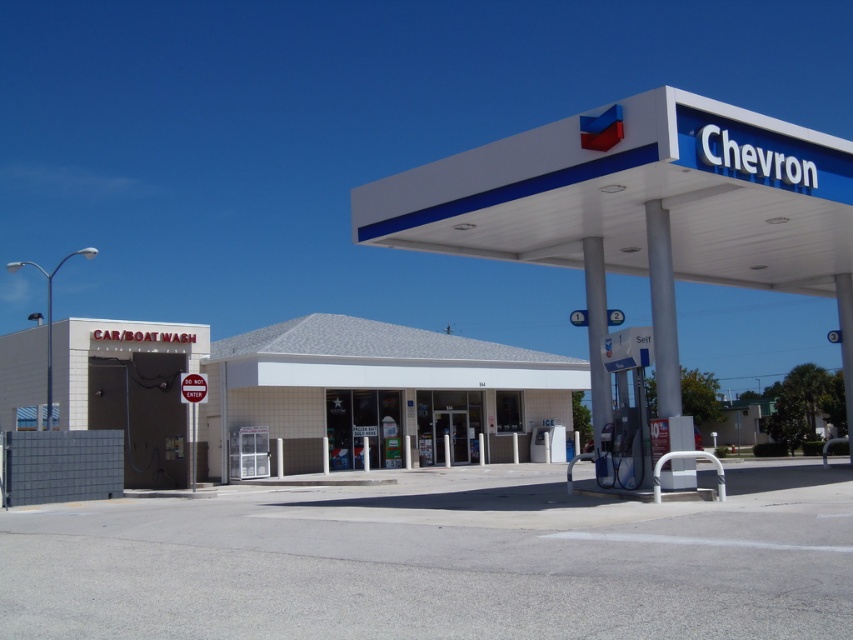
Who is shorter, white/smooth gas station canopy at center or white tile car wash at lower left?

Standing shorter between the two is white tile car wash at lower left.

This screenshot has height=640, width=853. What do you see at coordinates (639, 211) in the screenshot?
I see `white/smooth gas station canopy at center` at bounding box center [639, 211].

The image size is (853, 640). In order to click on white/smooth gas station canopy at center in this screenshot , I will do [x=639, y=211].

Does white tile building at center have a greater width compared to white tile car wash at lower left?

Indeed, white tile building at center has a greater width compared to white tile car wash at lower left.

Is white tile building at center below white tile car wash at lower left?

No, white tile building at center is not below white tile car wash at lower left.

Is point (563, 365) positioned before point (122, 324)?

No, (563, 365) is further to viewer.

This screenshot has width=853, height=640. Find the location of `white tile building at center`. white tile building at center is located at coordinates (381, 392).

Which is above, white/smooth gas station canopy at center or white tile building at center?

white/smooth gas station canopy at center

You are a GUI agent. You are given a task and a screenshot of the screen. Output one action in this format:
    pyautogui.click(x=<x>, y=<y>)
    Task: Click on the white/smooth gas station canopy at center
    The height and width of the screenshot is (640, 853).
    Given the screenshot: What is the action you would take?
    pyautogui.click(x=639, y=211)